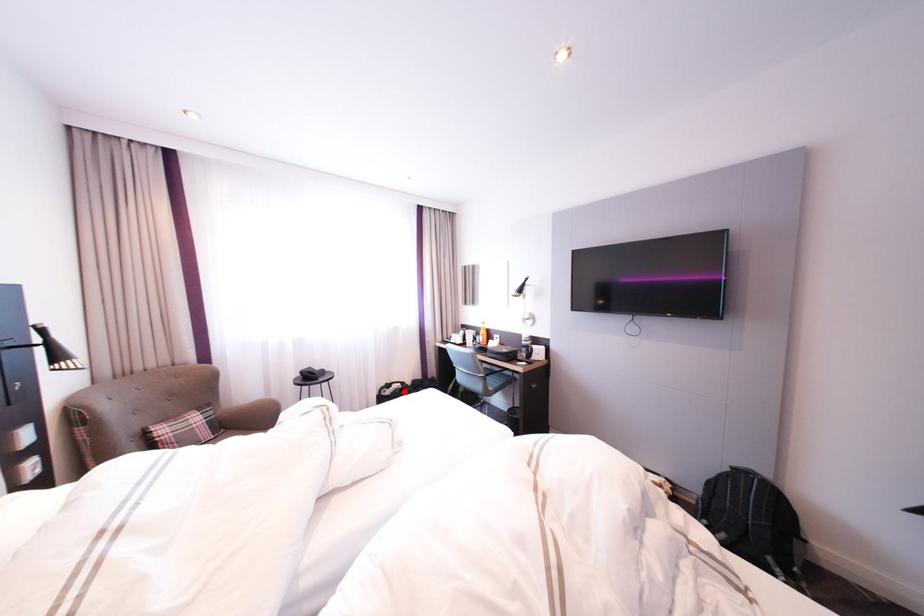
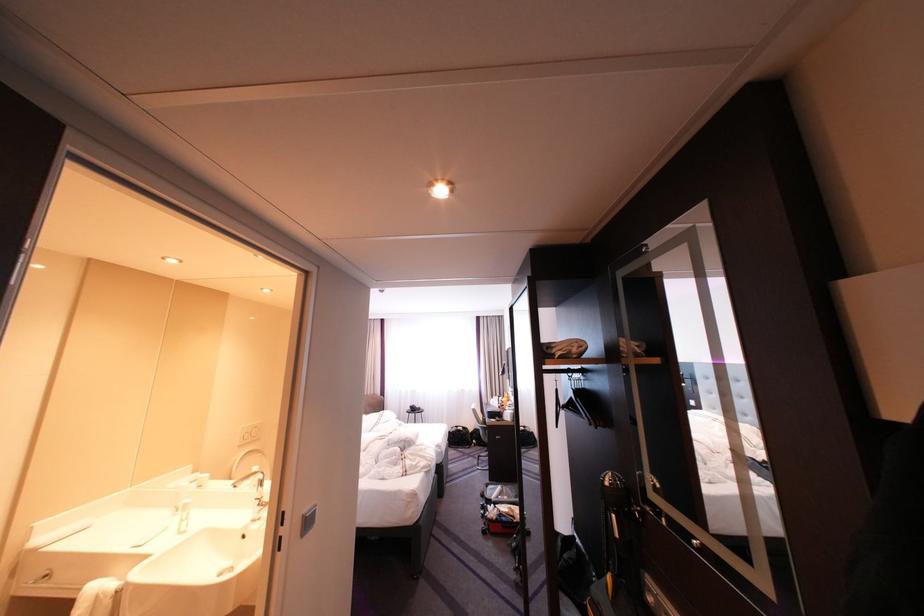
Question: I am providing you with two images of the same scene from different viewpoints. Image1 has a red point marked. In image2, the corresponding 3D location appears at what relative position? Reply with the corresponding letter.

Choices:
 (A) Closer
 (B) Farther

Answer: (B)